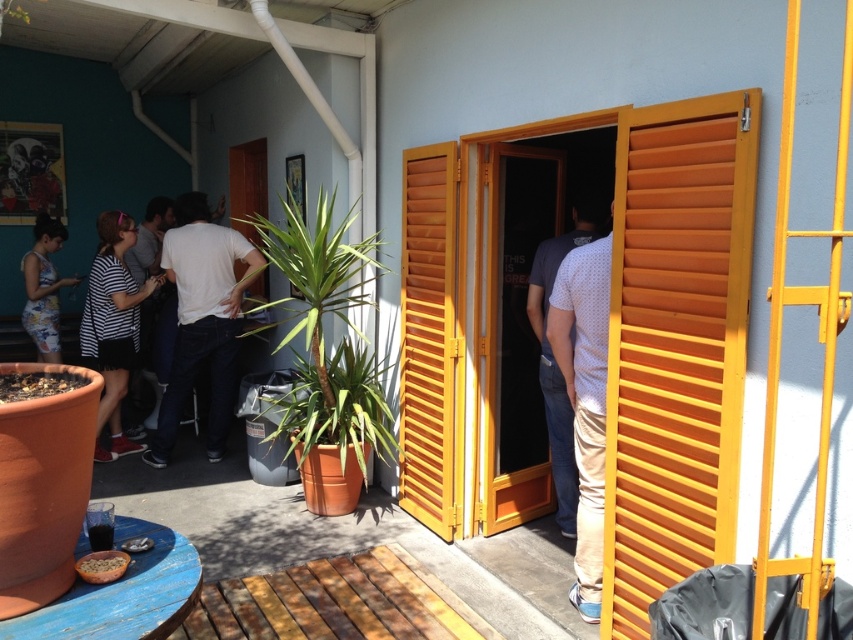
Does wooden at right have a greater height compared to striped cotton shirt at left?

Yes, wooden at right is taller than striped cotton shirt at left.

Is wooden at right to the right of striped cotton shirt at left from the viewer's perspective?

Indeed, wooden at right is positioned on the right side of striped cotton shirt at left.

Between point (408, 451) and point (114, 390), which one is positioned behind?

Point (114, 390)

Locate an element on the screen. The image size is (853, 640). wooden at right is located at coordinates (428, 337).

Is white matte shirt at center taller than striped fabric shirt at left?

Yes.

Which is behind, point (178, 252) or point (146, 356)?

Positioned behind is point (146, 356).

Is point (234, 321) farther from viewer compared to point (154, 326)?

No, (234, 321) is in front of (154, 326).

Locate an element on the screen. white matte shirt at center is located at coordinates (202, 320).

Which is in front, point (328, 220) or point (30, 298)?

Point (328, 220) is in front.

Does green matte plant at center have a greater width compared to floral dress at left?

Yes, green matte plant at center is wider than floral dress at left.

Locate an element on the screen. This screenshot has height=640, width=853. green matte plant at center is located at coordinates (323, 333).